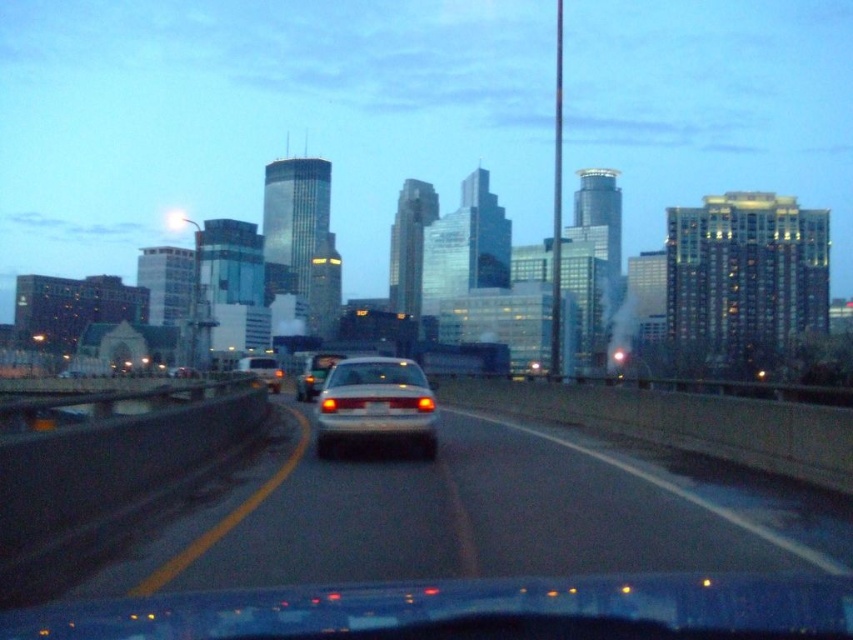
Question: Where is clear glass windshield at center located in relation to white glossy sedan at center in the image?

Choices:
 (A) right
 (B) left

Answer: (A)

Question: Can you confirm if satin white sedan at center is positioned above white glossy sedan at center?

Choices:
 (A) yes
 (B) no

Answer: (A)

Question: Which object is closer to the camera taking this photo?

Choices:
 (A) clear glass windshield at center
 (B) matte white van at center

Answer: (A)

Question: Which point is farther to the camera?

Choices:
 (A) (74, 596)
 (B) (280, 385)
 (C) (308, 392)

Answer: (B)

Question: Which object appears closest to the camera in this image?

Choices:
 (A) matte white van at center
 (B) white glossy sedan at center
 (C) clear glass windshield at center

Answer: (C)

Question: Does white glossy sedan at center appear over matte white van at center?

Choices:
 (A) yes
 (B) no

Answer: (A)